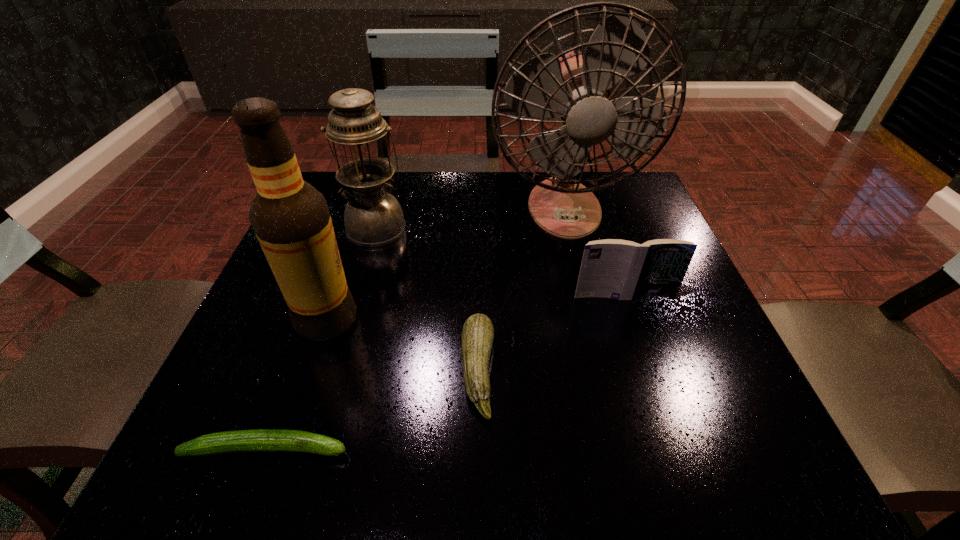
At what (x,y) coordinates should I click in order to perform the action: click on vacant space that satisfies the following two spatial constraints: 1. on the front cover of the book; 2. at the stem end of the right zucchini. Please return your answer as a coordinate pair (x, y). This screenshot has width=960, height=540. Looking at the image, I should click on (649, 371).

Where is `vacant space that satisfies the following two spatial constraints: 1. in front of the fan to direct airflow; 2. on the front-facing side of the shorter zucchini`? Image resolution: width=960 pixels, height=540 pixels. vacant space that satisfies the following two spatial constraints: 1. in front of the fan to direct airflow; 2. on the front-facing side of the shorter zucchini is located at coordinates (622, 449).

The image size is (960, 540). Identify the location of free location that satisfies the following two spatial constraints: 1. on the front cover of the fourth tallest object; 2. at the stem end of the second shortest object. (649, 371).

At what (x,y) coordinates should I click in order to perform the action: click on free spot that satisfies the following two spatial constraints: 1. on the front side of the oil lamp; 2. on the front-facing side of the left zucchini. Please return your answer as a coordinate pair (x, y). Image resolution: width=960 pixels, height=540 pixels. Looking at the image, I should click on (313, 449).

Identify the location of vacant space that satisfies the following two spatial constraints: 1. on the front cover of the third shortest object; 2. at the stem end of the second shortest object. (649, 371).

You are a GUI agent. You are given a task and a screenshot of the screen. Output one action in this format:
    pyautogui.click(x=<x>, y=<y>)
    Task: Click on the vacant space that satisfies the following two spatial constraints: 1. on the front cover of the book; 2. at the stem end of the fifth tallest object
    This screenshot has width=960, height=540.
    Given the screenshot: What is the action you would take?
    pyautogui.click(x=649, y=371)

Where is `vacant area that satisfies the following two spatial constraints: 1. on the front cover of the fourth tallest object; 2. on the label of the alcohol`? This screenshot has width=960, height=540. vacant area that satisfies the following two spatial constraints: 1. on the front cover of the fourth tallest object; 2. on the label of the alcohol is located at coordinates (632, 320).